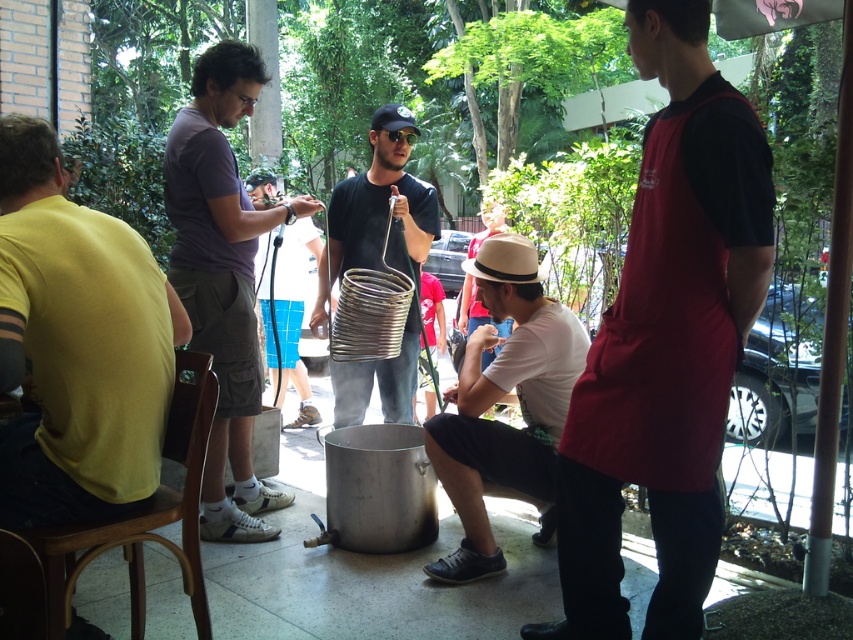
Is dark purple shirt at left to the right of matte black shirt at center from the viewer's perspective?

Yes, dark purple shirt at left is to the right of matte black shirt at center.

What are the coordinates of `dark purple shirt at left` in the screenshot? It's located at (223, 276).

What are the coordinates of `dark purple shirt at left` in the screenshot? It's located at (223, 276).

Is black matte apron at right bigger than shiny metallic spiral at center?

Correct, black matte apron at right is larger in size than shiny metallic spiral at center.

Which of these two, black matte apron at right or shiny metallic spiral at center, stands taller?

black matte apron at right is taller.

Find the location of a particular element. black matte apron at right is located at coordinates (666, 340).

Which of these two, dark purple shirt at left or white cotton shirt at lower center, stands taller?

Standing taller between the two is dark purple shirt at left.

Is dark purple shirt at left wider than white cotton shirt at lower center?

Indeed, dark purple shirt at left has a greater width compared to white cotton shirt at lower center.

This screenshot has width=853, height=640. Find the location of `dark purple shirt at left`. dark purple shirt at left is located at coordinates (223, 276).

Locate an element on the screen. The image size is (853, 640). dark purple shirt at left is located at coordinates (223, 276).